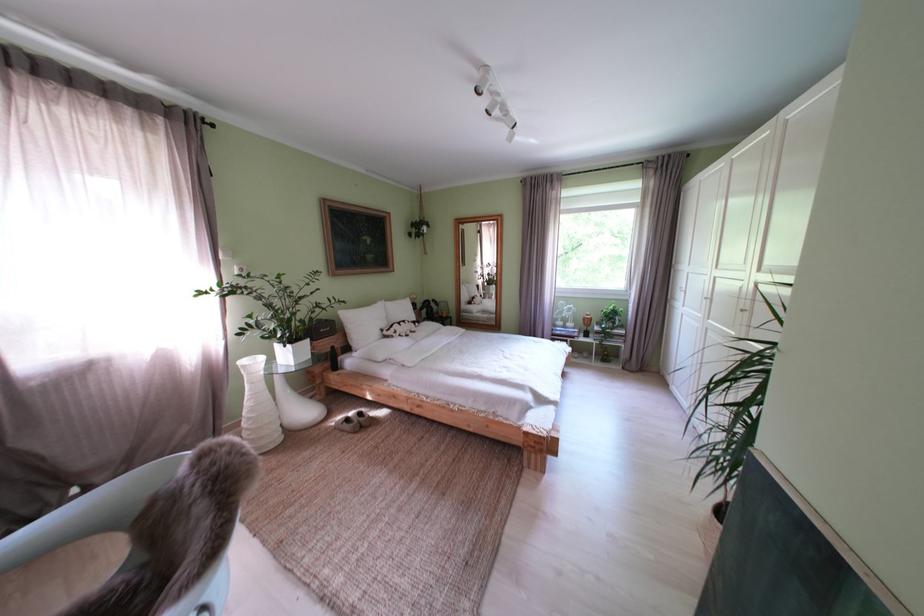
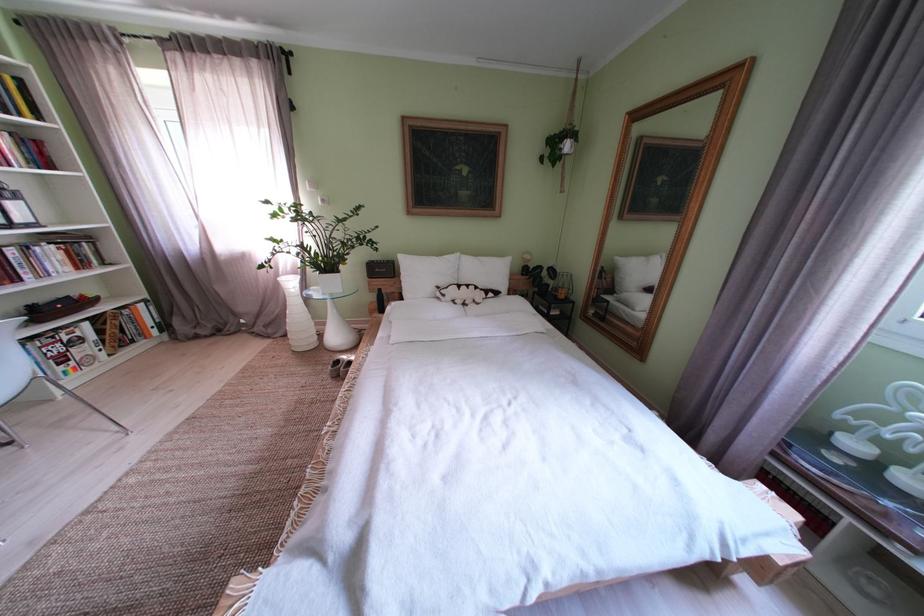
Locate, in the second image, the point that corresponds to pixel 359 424 in the first image.

(348, 367)